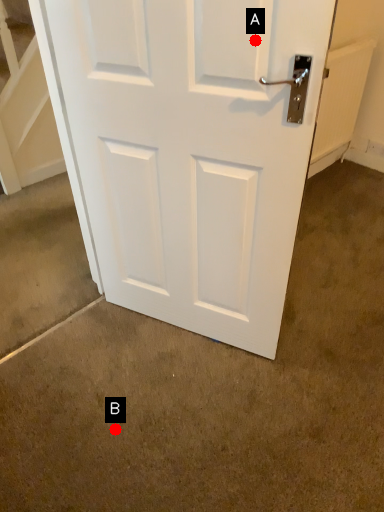
Question: Two points are circled on the image, labeled by A and B beside each circle. Which point appears farthest from the camera in this image?

Choices:
 (A) A is further
 (B) B is further

Answer: (B)